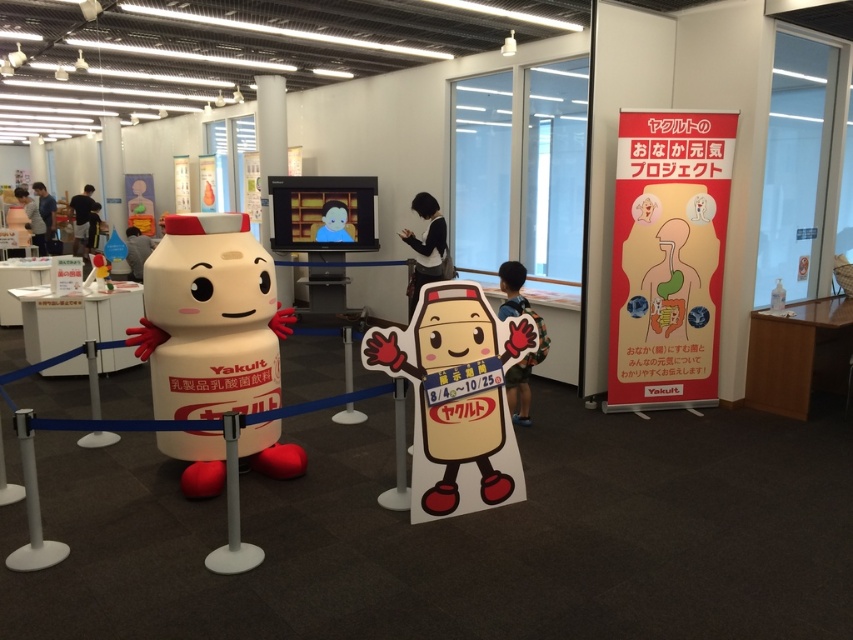
Question: Which of the following is the closest to the observer?

Choices:
 (A) red paper banner at right
 (B) white matte plastic toy at center
 (C) white cardboard mascot at center

Answer: (C)

Question: Where is red paper banner at right located in relation to white cardboard mascot at center in the image?

Choices:
 (A) above
 (B) below

Answer: (A)

Question: Which object appears closest to the camera in this image?

Choices:
 (A) white matte plastic toy at center
 (B) red paper banner at right

Answer: (A)

Question: In this image, where is white matte plastic toy at center located relative to white cardboard mascot at center?

Choices:
 (A) below
 (B) above

Answer: (B)

Question: Which point is closer to the camera taking this photo?

Choices:
 (A) (x=416, y=353)
 (B) (x=627, y=321)
 (C) (x=209, y=314)

Answer: (A)

Question: Does red paper banner at right have a lesser width compared to white cardboard mascot at center?

Choices:
 (A) yes
 (B) no

Answer: (B)